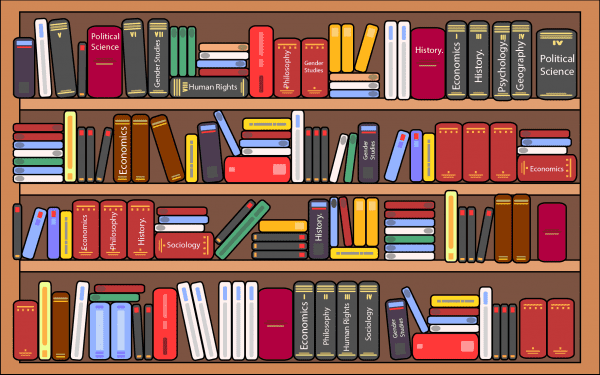
Find the location of a particular element. This screenshot has width=600, height=375. dark green books is located at coordinates (106, 296), (44, 161), (174, 59), (181, 64), (192, 70), (348, 174), (251, 220), (421, 238).